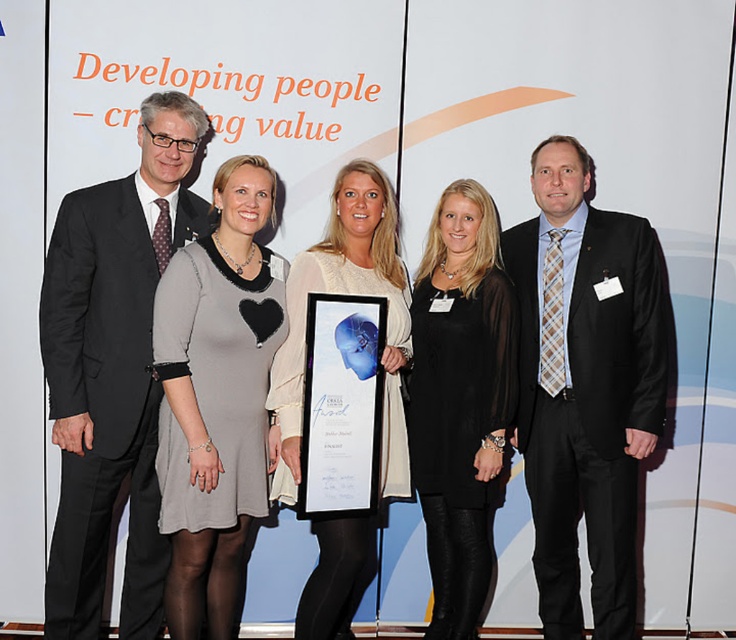
You are a photographer at the event and need to adjust the lighting so that both the gray matte dress at center and the white lace dress at center are equally visible. Considering their sizes, which dress requires more or less light adjustment?

The gray matte dress at center is smaller in size compared to the white lace dress at center. Since the gray matte dress is smaller, it may require more focused lighting to ensure it stands out, while the white lace dress, being larger, might naturally capture more light and thus needs less adjustment.

You are organizing a photo shoot and want to ensure that the matte black suit at right and the white lace dress at center are clearly visible in the final image. Given their spatial relationship, which object might require more attention to ensure it doesn not get lost in the composition?

The matte black suit at right occupies less space than the white lace dress at center, so it might require more attention to ensure it doesn not get lost in the composition.